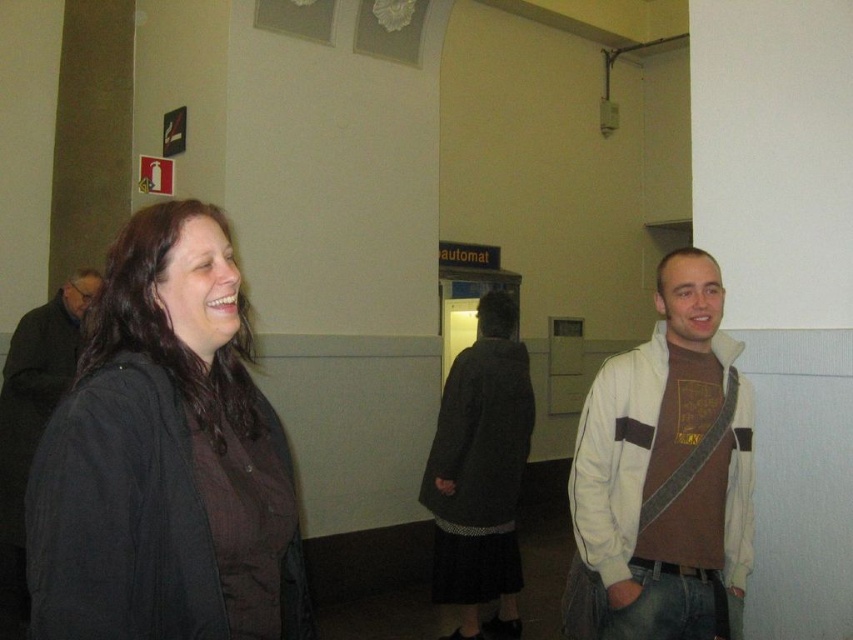
Does point (73, 426) come behind point (21, 387)?

That is False.

Which is behind, point (242, 372) or point (13, 470)?

Point (13, 470)

Is point (120, 618) more distant than point (56, 337)?

No, (120, 618) is in front of (56, 337).

Identify the location of black matte jacket at left. The width and height of the screenshot is (853, 640). (166, 458).

Between black matte jacket at left and dark gray wool coat at center, which one appears on the right side from the viewer's perspective?

dark gray wool coat at center

Which is above, black matte jacket at left or dark gray wool coat at center?

Positioned higher is black matte jacket at left.

At what (x,y) coordinates should I click in order to perform the action: click on black matte jacket at left. Please return your answer as a coordinate pair (x, y). The width and height of the screenshot is (853, 640). Looking at the image, I should click on (166, 458).

Identify the location of black matte jacket at left. (166, 458).

This screenshot has width=853, height=640. Describe the element at coordinates (480, 474) in the screenshot. I see `dark gray wool coat at center` at that location.

In the scene shown: Does dark gray wool coat at center have a greater width compared to dark gray coat at left?

No.

Looking at this image, measure the distance between dark gray wool coat at center and camera.

dark gray wool coat at center and camera are 3.71 meters apart from each other.

This screenshot has width=853, height=640. What are the coordinates of `dark gray wool coat at center` in the screenshot? It's located at (480, 474).